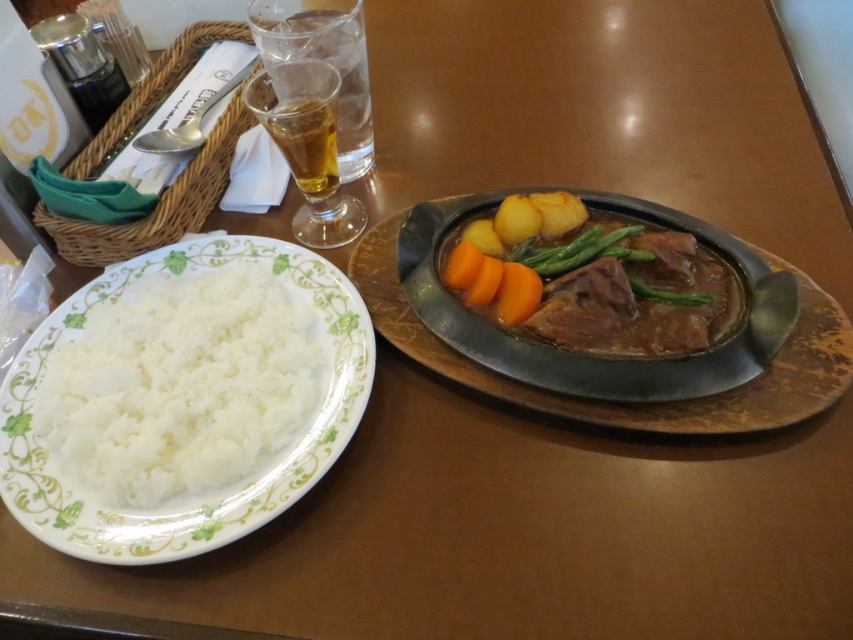
Between white matte rice at left and brown glossy stew at center, which one appears on the right side from the viewer's perspective?

From the viewer's perspective, brown glossy stew at center appears more on the right side.

Which is below, white matte rice at left or brown glossy stew at center?

white matte rice at left is lower down.

Measure the distance between white matte rice at left and camera.

16.36 inches

Where is `white matte rice at left`? Image resolution: width=853 pixels, height=640 pixels. white matte rice at left is located at coordinates (178, 385).

Can you confirm if metallic platter at center right is wider than brown glossy stew at center?

Correct, the width of metallic platter at center right exceeds that of brown glossy stew at center.

Is metallic platter at center right taller than brown glossy stew at center?

Correct, metallic platter at center right is much taller as brown glossy stew at center.

Is point (694, 406) positioned behind point (601, 333)?

No, it is not.

Image resolution: width=853 pixels, height=640 pixels. Identify the location of metallic platter at center right. (578, 355).

Between point (482, 310) and point (292, 132), which one is positioned behind?

The point (292, 132) is behind.

Who is lower down, brown glossy stew at center or translucent glass beer at upper center?

brown glossy stew at center

At what (x,y) coordinates should I click in order to perform the action: click on brown glossy stew at center. Please return your answer as a coordinate pair (x, y). The width and height of the screenshot is (853, 640). Looking at the image, I should click on (628, 288).